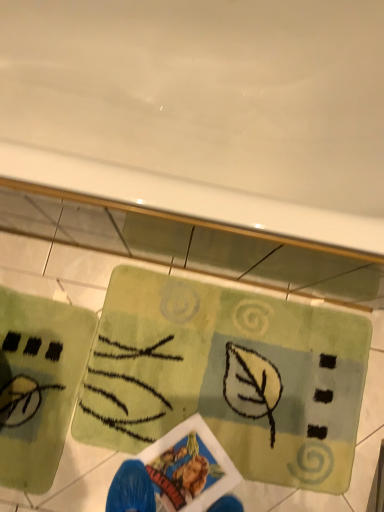
Question: Are green soft yoga mat at lower left, arranged as the second yoga mat when viewed from the right, and green textured rug at center, the second yoga mat in the left-to-right sequence, located far from each other?

Choices:
 (A) yes
 (B) no

Answer: (B)

Question: Considering the relative sizes of green soft yoga mat at lower left, the first yoga mat from the left, and green textured rug at center, the second yoga mat in the left-to-right sequence, in the image provided, is green soft yoga mat at lower left, the first yoga mat from the left, shorter than green textured rug at center, the second yoga mat in the left-to-right sequence,?

Choices:
 (A) yes
 (B) no

Answer: (B)

Question: Does green soft yoga mat at lower left, arranged as the second yoga mat when viewed from the right, come behind green textured rug at center, which ranks as the first yoga mat in right-to-left order?

Choices:
 (A) no
 (B) yes

Answer: (A)

Question: From the image's perspective, does green soft yoga mat at lower left, the first yoga mat from the left, appear higher than green textured rug at center, the second yoga mat in the left-to-right sequence?

Choices:
 (A) yes
 (B) no

Answer: (B)

Question: Does green soft yoga mat at lower left, the first yoga mat from the left, have a larger size compared to green textured rug at center, which ranks as the first yoga mat in right-to-left order?

Choices:
 (A) no
 (B) yes

Answer: (A)

Question: Is green soft yoga mat at lower left, arranged as the second yoga mat when viewed from the right, at the right side of green textured rug at center, which ranks as the first yoga mat in right-to-left order?

Choices:
 (A) yes
 (B) no

Answer: (B)

Question: Does green textured rug at center, which ranks as the first yoga mat in right-to-left order, appear on the right side of green soft yoga mat at lower left, arranged as the second yoga mat when viewed from the right?

Choices:
 (A) yes
 (B) no

Answer: (A)

Question: Considering the relative sizes of green textured rug at center, the second yoga mat in the left-to-right sequence, and green soft yoga mat at lower left, the first yoga mat from the left, in the image provided, is green textured rug at center, the second yoga mat in the left-to-right sequence, wider than green soft yoga mat at lower left, the first yoga mat from the left,?

Choices:
 (A) no
 (B) yes

Answer: (B)

Question: From a real-world perspective, is green textured rug at center, which ranks as the first yoga mat in right-to-left order, on green soft yoga mat at lower left, arranged as the second yoga mat when viewed from the right?

Choices:
 (A) no
 (B) yes

Answer: (A)

Question: Is green textured rug at center, which ranks as the first yoga mat in right-to-left order, oriented towards green soft yoga mat at lower left, the first yoga mat from the left?

Choices:
 (A) yes
 (B) no

Answer: (B)

Question: Is green textured rug at center, the second yoga mat in the left-to-right sequence, completely or partially outside of green soft yoga mat at lower left, the first yoga mat from the left?

Choices:
 (A) yes
 (B) no

Answer: (A)

Question: Can you confirm if green textured rug at center, which ranks as the first yoga mat in right-to-left order, is thinner than green soft yoga mat at lower left, the first yoga mat from the left?

Choices:
 (A) yes
 (B) no

Answer: (B)

Question: From the image's perspective, relative to green textured rug at center, which ranks as the first yoga mat in right-to-left order, is green soft yoga mat at lower left, arranged as the second yoga mat when viewed from the right, above or below?

Choices:
 (A) above
 (B) below

Answer: (B)